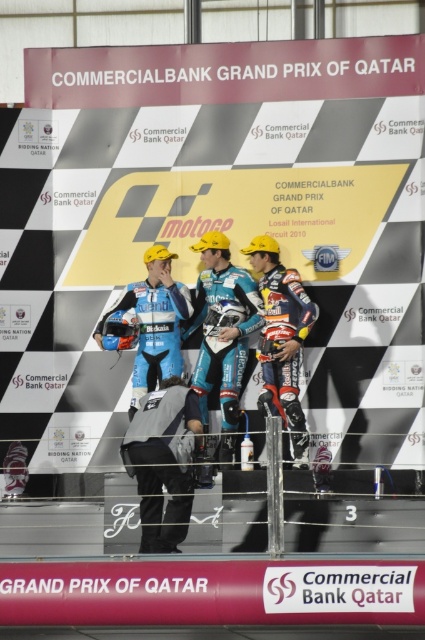
Question: Which of the following is the closest to the observer?

Choices:
 (A) blue matte suit at center
 (B) teal matte suit at center
 (C) shiny red motorcycle racer at center
 (D) gray fabric jacket at center

Answer: (D)

Question: Is shiny red motorcycle racer at center above blue matte suit at center?

Choices:
 (A) yes
 (B) no

Answer: (B)

Question: Which object is positioned closest to the gray fabric jacket at center?

Choices:
 (A) teal matte suit at center
 (B) blue matte suit at center

Answer: (A)

Question: Is teal matte suit at center positioned at the back of shiny red motorcycle racer at center?

Choices:
 (A) yes
 (B) no

Answer: (A)

Question: Based on their relative distances, which object is farther from the gray fabric jacket at center?

Choices:
 (A) blue matte suit at center
 (B) shiny red motorcycle racer at center
 (C) teal matte suit at center

Answer: (B)

Question: In this image, where is teal matte suit at center located relative to shiny red motorcycle racer at center?

Choices:
 (A) above
 (B) below

Answer: (A)